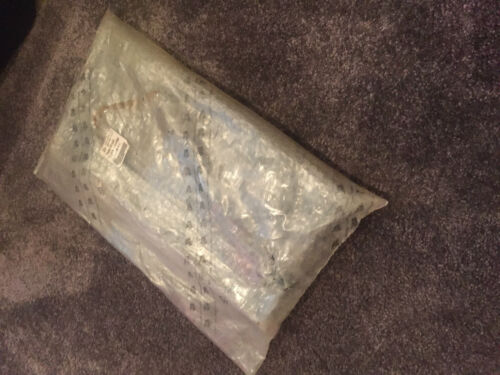
The height and width of the screenshot is (375, 500). Identify the location of carpet below package. click(x=108, y=310).